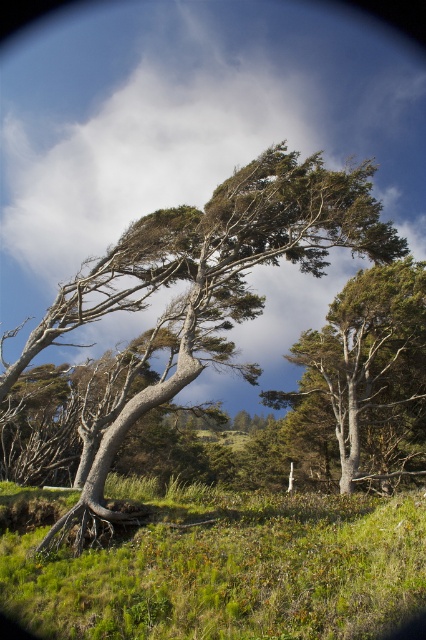
I want to click on green grassy at lower left, so click(221, 568).

Where is `green grassy at lower left`? green grassy at lower left is located at coordinates (221, 568).

Who is more distant from viewer, (227, 502) or (264, 224)?

Point (264, 224)

This screenshot has height=640, width=426. Describe the element at coordinates (221, 568) in the screenshot. I see `green grassy at lower left` at that location.

Locate an element on the screen. This screenshot has height=640, width=426. green grassy at lower left is located at coordinates (221, 568).

How far apart are gray bark tree at center and green textured tree at center?

6.57 meters

Is gray bark tree at center closer to camera compared to green textured tree at center?

Yes, gray bark tree at center is in front of green textured tree at center.

What do you see at coordinates (212, 276) in the screenshot? I see `gray bark tree at center` at bounding box center [212, 276].

This screenshot has height=640, width=426. Find the location of `gray bark tree at center`. gray bark tree at center is located at coordinates (212, 276).